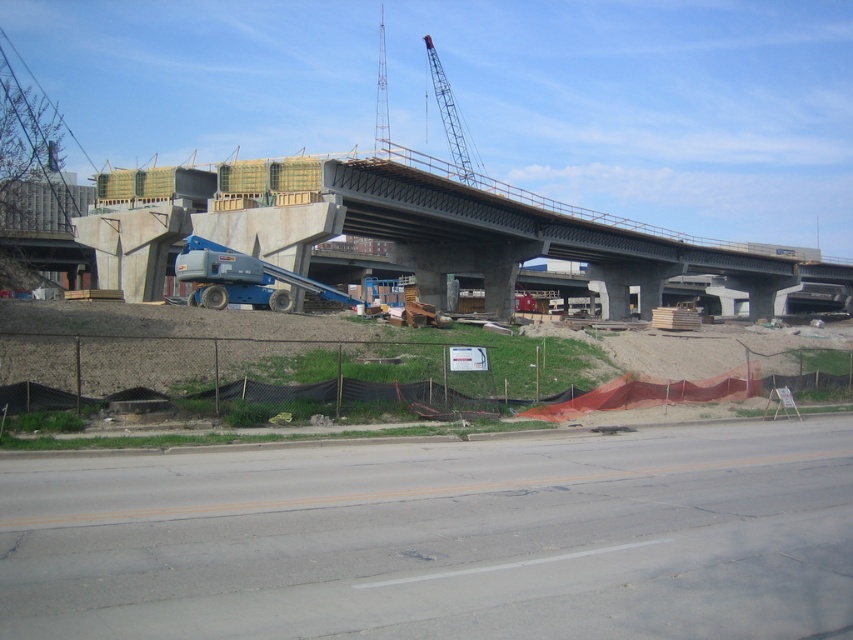
Does gray asphalt highway at lower center appear under metallic gray crane at upper center?

Correct, gray asphalt highway at lower center is located below metallic gray crane at upper center.

Between point (602, 540) and point (456, 138), which one is positioned in front?

Point (602, 540) is in front.

The image size is (853, 640). I want to click on gray asphalt highway at lower center, so click(x=440, y=540).

The width and height of the screenshot is (853, 640). Find the location of `gray asphalt highway at lower center`. gray asphalt highway at lower center is located at coordinates (440, 540).

Consider the image. Between gray asphalt highway at lower center and concrete at center, which one has more height?

Standing taller between the two is concrete at center.

Is point (379, 458) positioned behind point (431, 157)?

No.

The width and height of the screenshot is (853, 640). Identify the location of gray asphalt highway at lower center. (440, 540).

Does concrete at center appear on the left side of metallic gray crane at upper center?

In fact, concrete at center is to the right of metallic gray crane at upper center.

Who is more distant from viewer, (531, 252) or (471, 168)?

The point (471, 168) is behind.

Which is behind, point (347, 216) or point (438, 68)?

Point (438, 68)

Image resolution: width=853 pixels, height=640 pixels. Find the location of `concrete at center`. concrete at center is located at coordinates (497, 225).